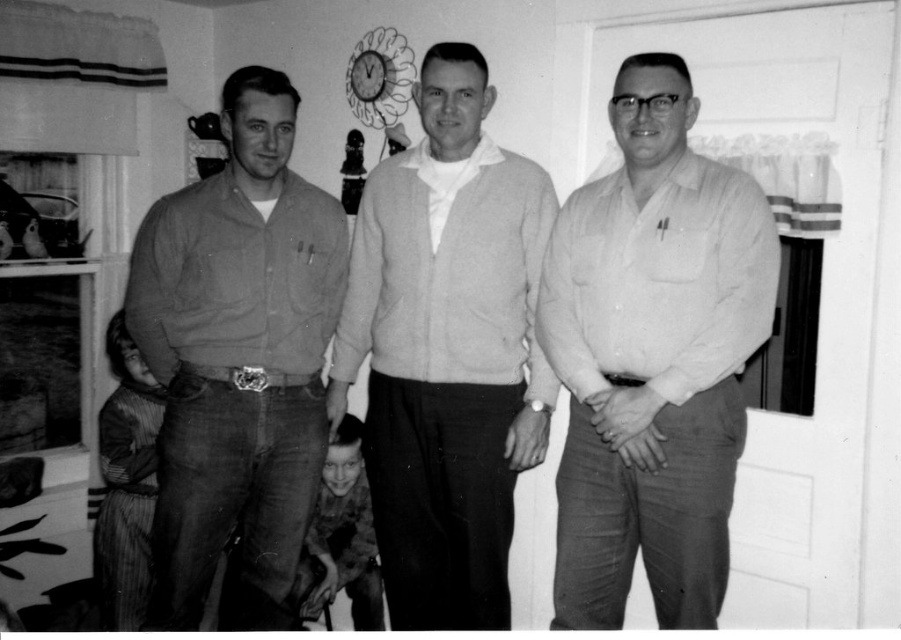
Does white smooth shirt at center have a lesser width compared to matte brown shirt at left?

Indeed, white smooth shirt at center has a lesser width compared to matte brown shirt at left.

Between point (758, 260) and point (279, 529), which one is positioned behind?

The point (279, 529) is behind.

Locate an element on the screen. white smooth shirt at center is located at coordinates (652, 356).

Who is more forward, [502,440] or [244,552]?

Positioned in front is point [502,440].

In order to click on light gray sweater at center in this screenshot , I will do `click(447, 349)`.

Between point (481, 320) and point (305, 492), which one is positioned in front?

Positioned in front is point (481, 320).

Locate an element on the screen. The image size is (901, 640). light gray sweater at center is located at coordinates (447, 349).

Is point (576, 419) closer to camera compared to point (525, 168)?

Yes, it is in front of point (525, 168).

Is white smooth shirt at center thinner than light gray sweater at center?

Yes.

Between point (640, 168) and point (422, 438), which one is positioned in front?

Point (640, 168)

The image size is (901, 640). In order to click on white smooth shirt at center in this screenshot , I will do `click(652, 356)`.